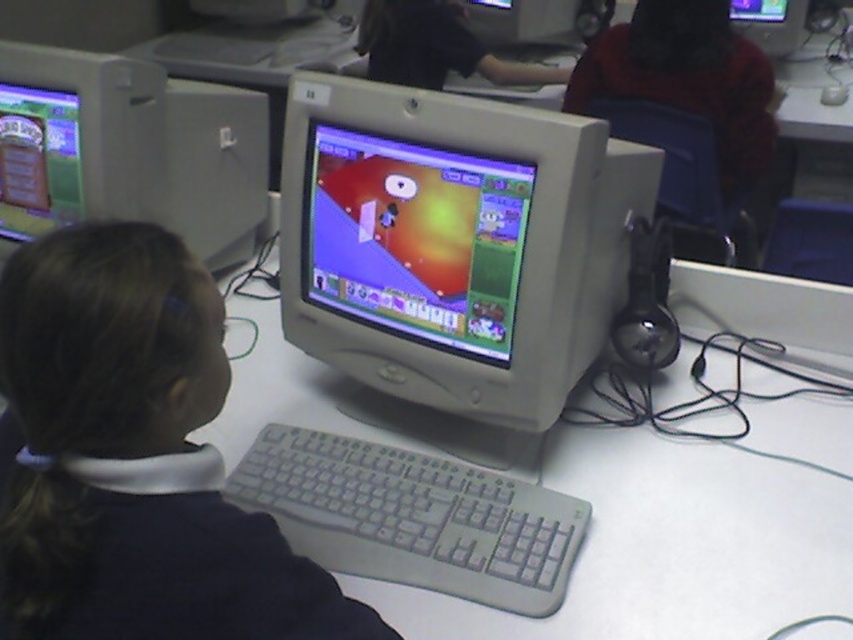
You are a teacher in the classroom and want to check both the matte plastic monitor at center and the matte gray monitor at upper center. Which monitor should you look at first if you want to start from the one closer to the floor?

The matte plastic monitor at center is located below the matte gray monitor at upper center, so you should look at the matte plastic monitor at center first since it is closer to the floor.

You are a teacher in the classroom and want to adjust the position of the matte plastic monitor at center and the matte gray monitor at upper center. Which monitor should you move if you want to place a larger object on the desk where the smaller monitor is currently located?

The matte gray monitor at upper center is smaller, so you should move it to place the larger object where it is currently located.